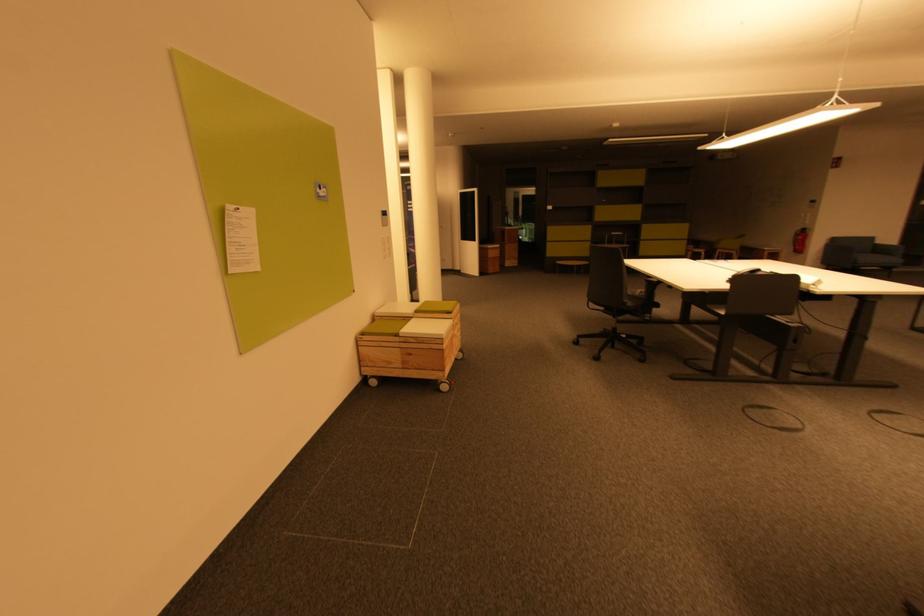
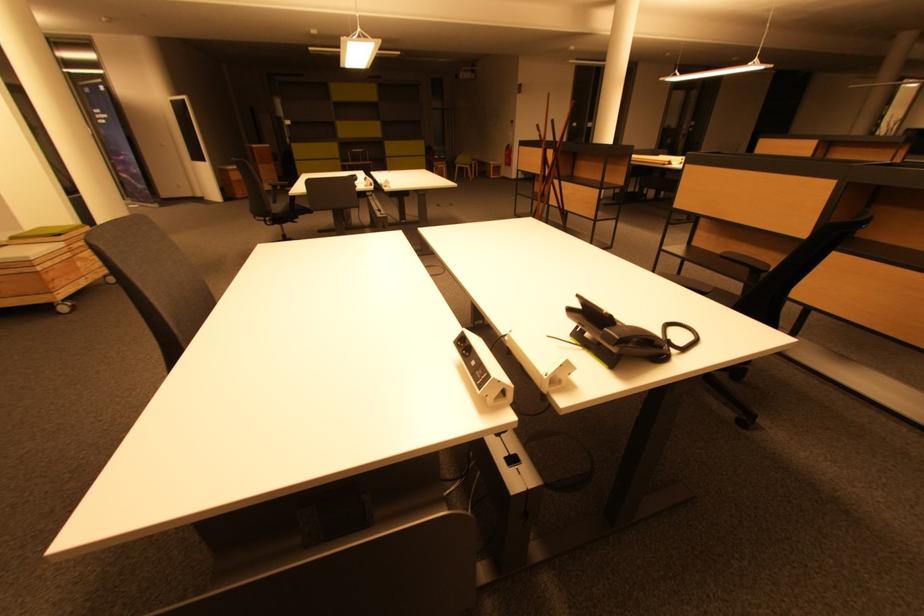
Which direction would the cameraman need to move to produce the second image?

The cameraman moved toward right, backward.